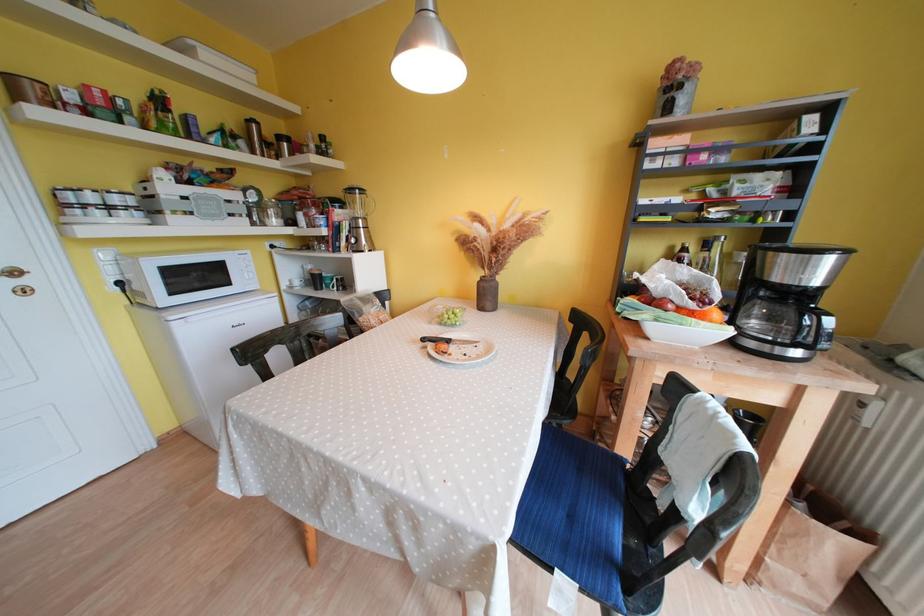
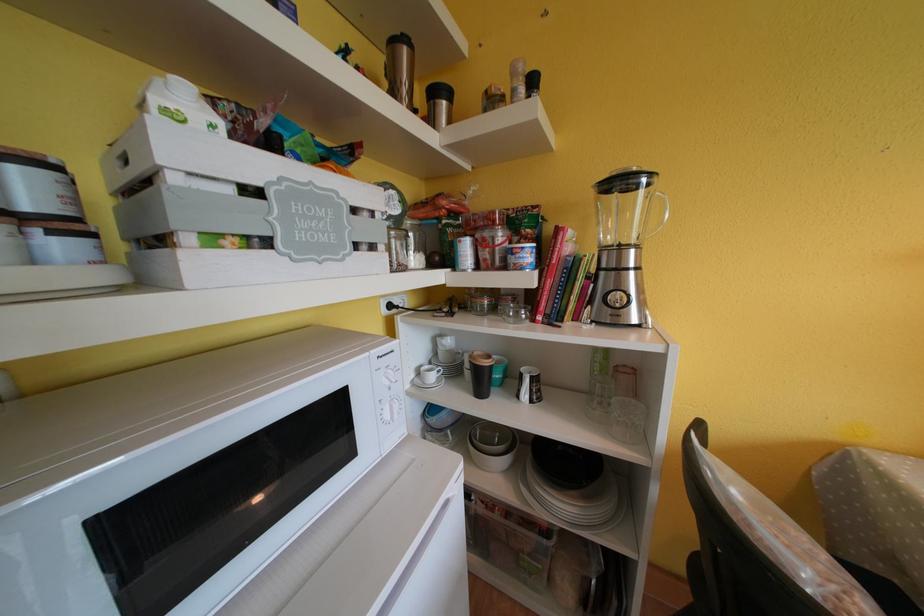
In the second image, find the point that corresponds to the point at 367,224 in the first image.

(638, 254)